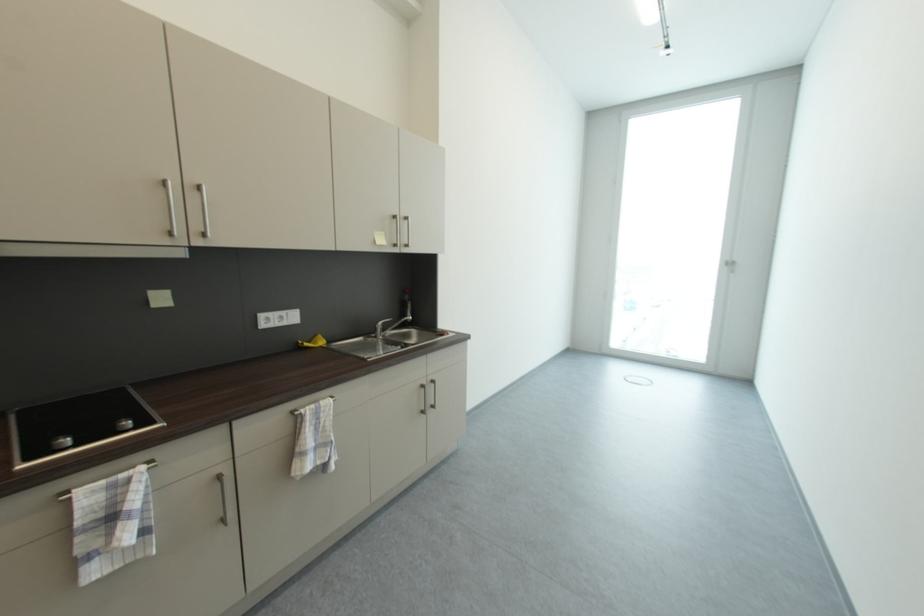
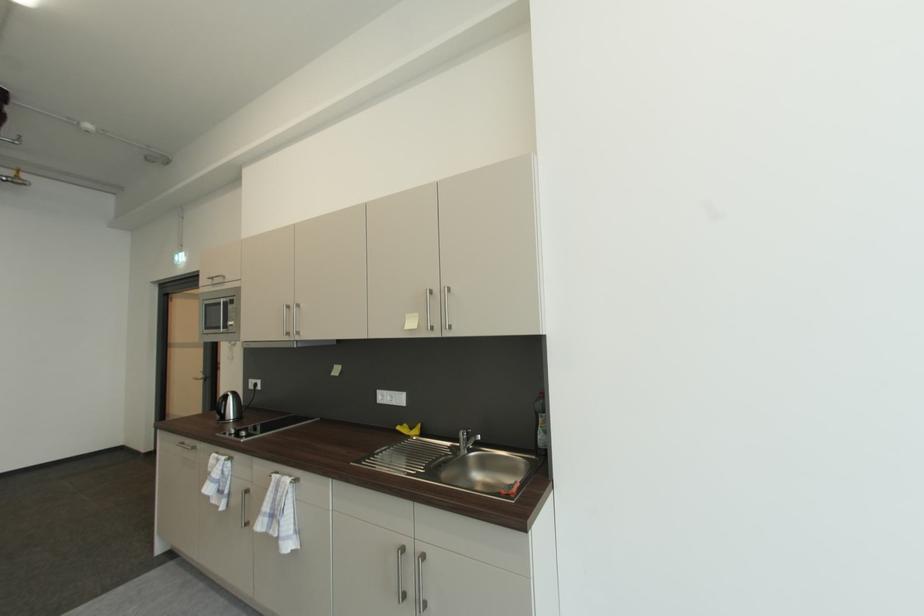
The point at (82,525) is marked in the first image. Where is the corresponding point in the second image?

(215, 471)